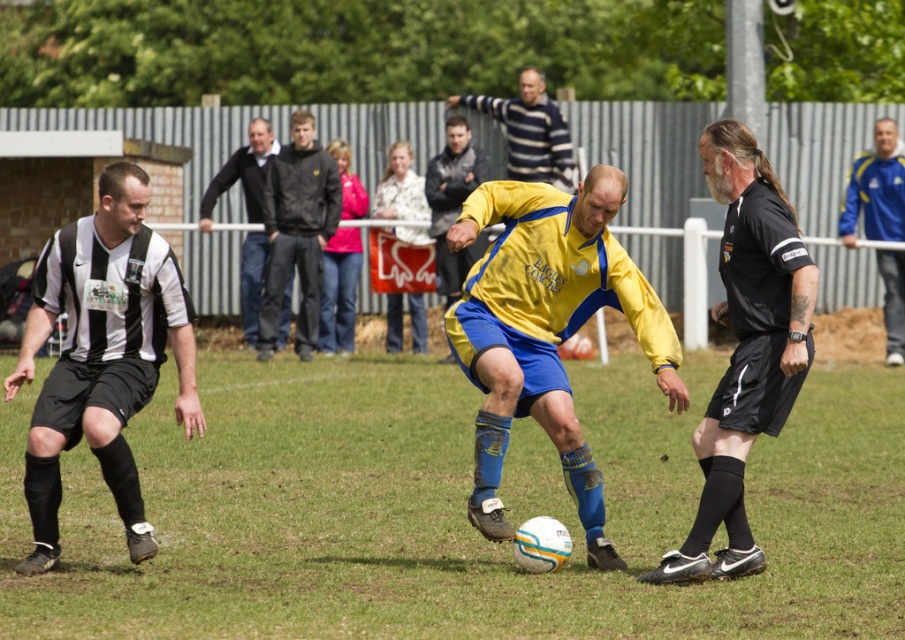
Question: Does black and white jersey at left have a lesser width compared to black matte jacket at center?

Choices:
 (A) yes
 (B) no

Answer: (B)

Question: Which point is farther to the camera?

Choices:
 (A) black matte jacket at center
 (B) black jersey at upper center
 (C) blue synthetic jacket at upper right

Answer: (B)

Question: Can you confirm if black matte referee shirt at right is smaller than blue synthetic jacket at upper right?

Choices:
 (A) no
 (B) yes

Answer: (A)

Question: Which point is farther from the camera taking this photo?

Choices:
 (A) (284, 508)
 (B) (563, 376)

Answer: (A)

Question: Is yellow matte jersey at center to the left of blue synthetic jacket at upper right from the viewer's perspective?

Choices:
 (A) no
 (B) yes

Answer: (B)

Question: Which point appears closest to the camera in this image?

Choices:
 (A) (750, 157)
 (B) (846, 208)
 (C) (568, 420)

Answer: (A)